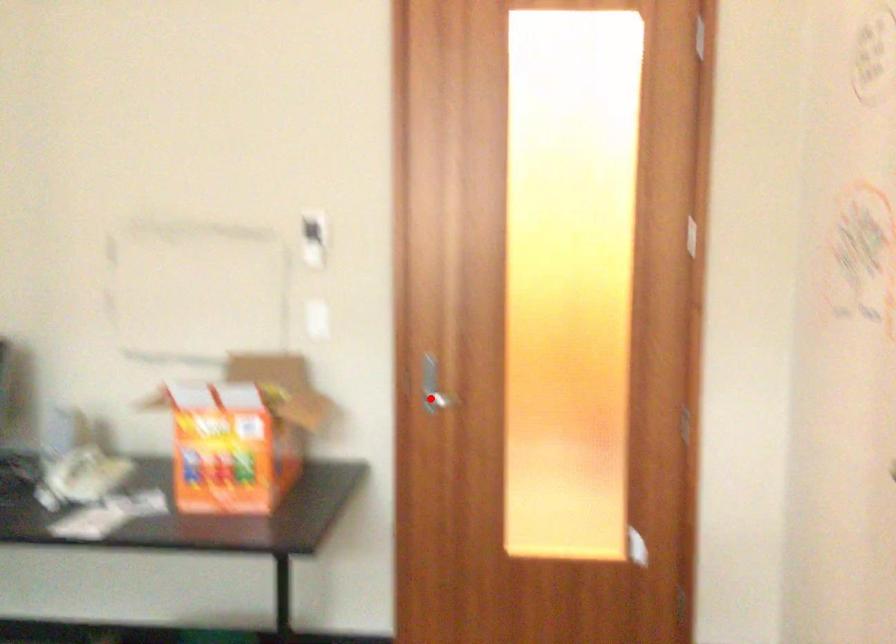
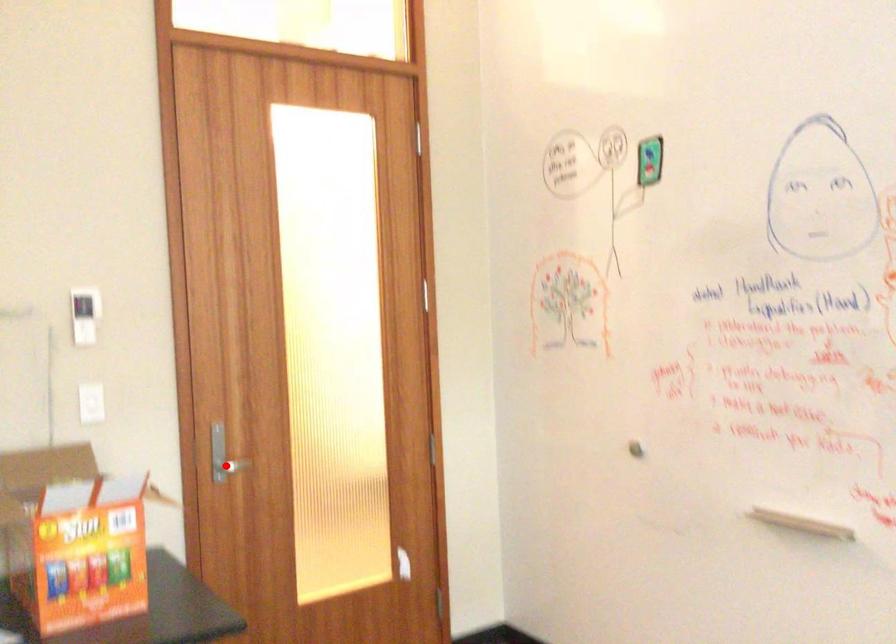
Based on the photo, I am providing you with two images of the same scene from different viewpoints. A red point is marked on the first image and another point is marked on the second image. Is the marked point in image1 the same physical position as the marked point in image2?

Yes